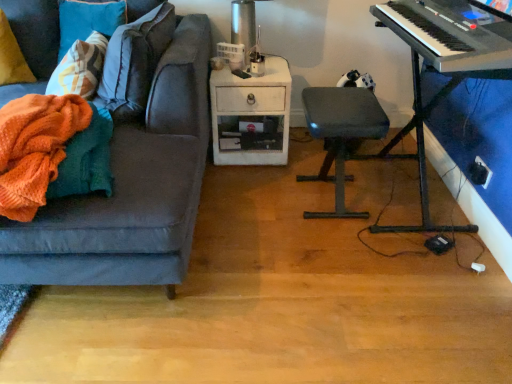
Where is `vacant area that lies between white wicker side table at center and matte gray stool at center`? Image resolution: width=512 pixels, height=384 pixels. vacant area that lies between white wicker side table at center and matte gray stool at center is located at coordinates (282, 176).